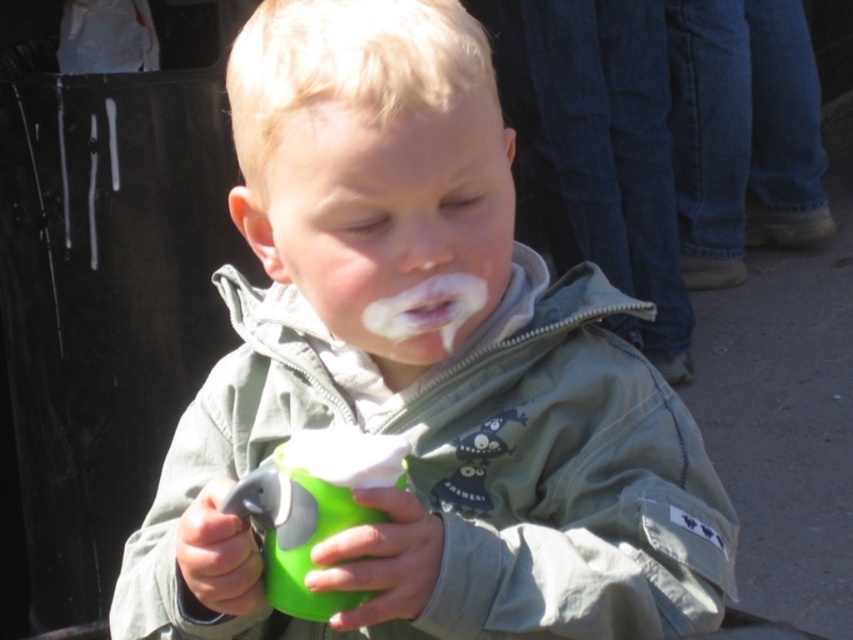
The child is holding a green matte cup at center and has a smooth flesh nose at center. Which object is closer to the viewer?

The green matte cup at center is closer to the viewer than the smooth flesh nose at center because it is in front of it.

You are a photographer trying to capture a closeup of the child holding the bright green cup with a gray lid. The camera you are using has a focus range of 60 to 70 centimeters. Is the point at coordinates point (x=402, y=330) within the focus range of your camera?

The point point (x=402, y=330) is 67.66 centimeters away from the camera, which falls within the focus range of 60 to 70 centimeters. Therefore, the camera can focus on that point.

The child in the image has a white matte frosting at mouth center and a white matte mouth at center. Which one is closer to you?

The white matte frosting at mouth center is closer to you because the white matte mouth at center is behind it.